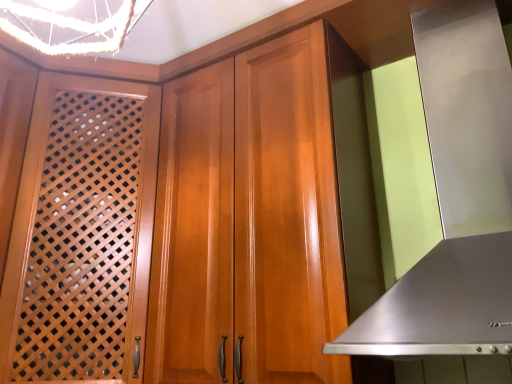
The width and height of the screenshot is (512, 384). Identify the location of stainless steel exhaust hood at right. (456, 198).

Measure the distance between point (436, 9) and camera.

3.82 feet.

What do you see at coordinates (456, 198) in the screenshot? I see `stainless steel exhaust hood at right` at bounding box center [456, 198].

I want to click on wooden lattice screen door at left, so click(x=81, y=234).

The image size is (512, 384). What do you see at coordinates (81, 234) in the screenshot? I see `wooden lattice screen door at left` at bounding box center [81, 234].

Measure the distance between point (57, 312) and camera.

Point (57, 312) and camera are 3.93 feet apart from each other.

At what (x,y) coordinates should I click in order to perform the action: click on stainless steel exhaust hood at right. Please return your answer as a coordinate pair (x, y). The width and height of the screenshot is (512, 384). Looking at the image, I should click on (456, 198).

Considering the relative positions of wooden lattice screen door at left and stainless steel exhaust hood at right in the image provided, is wooden lattice screen door at left to the left of stainless steel exhaust hood at right from the viewer's perspective?

Correct, you'll find wooden lattice screen door at left to the left of stainless steel exhaust hood at right.

Considering the positions of objects wooden lattice screen door at left and stainless steel exhaust hood at right in the image provided, who is behind, wooden lattice screen door at left or stainless steel exhaust hood at right?

wooden lattice screen door at left.

Is point (40, 354) positioned before point (442, 340)?

No, (40, 354) is behind (442, 340).

From the image's perspective, is wooden lattice screen door at left under stainless steel exhaust hood at right?

Indeed, from the image's perspective, wooden lattice screen door at left is shown beneath stainless steel exhaust hood at right.

From a real-world perspective, which is physically below, wooden lattice screen door at left or stainless steel exhaust hood at right?

In real-world perspective, wooden lattice screen door at left is lower.

Looking at their sizes, would you say wooden lattice screen door at left is wider or thinner than stainless steel exhaust hood at right?

wooden lattice screen door at left is wider than stainless steel exhaust hood at right.

Between wooden lattice screen door at left and stainless steel exhaust hood at right, which one has more height?

wooden lattice screen door at left.

In terms of size, does wooden lattice screen door at left appear bigger or smaller than stainless steel exhaust hood at right?

wooden lattice screen door at left is bigger than stainless steel exhaust hood at right.

Would you say stainless steel exhaust hood at right is part of wooden lattice screen door at left's contents?

No, stainless steel exhaust hood at right is not a part of wooden lattice screen door at left.

Are wooden lattice screen door at left and stainless steel exhaust hood at right making contact?

wooden lattice screen door at left and stainless steel exhaust hood at right are clearly separated.

Based on the photo, could you tell me if wooden lattice screen door at left is facing stainless steel exhaust hood at right?

No, wooden lattice screen door at left is not turned towards stainless steel exhaust hood at right.

Can you tell me how much wooden lattice screen door at left and stainless steel exhaust hood at right differ in facing direction?

The angle between the facing direction of wooden lattice screen door at left and the facing direction of stainless steel exhaust hood at right is 44.3 degrees.

How far apart are wooden lattice screen door at left and stainless steel exhaust hood at right?

34.21 inches.

At what (x,y) coordinates should I click in order to perform the action: click on screen door located underneath the stainless steel exhaust hood at right (from a real-world perspective). Please return your answer as a coordinate pair (x, y). The width and height of the screenshot is (512, 384). Looking at the image, I should click on (81, 234).

Considering the relative positions of stainless steel exhaust hood at right and wooden lattice screen door at left in the image provided, is stainless steel exhaust hood at right to the left or to the right of wooden lattice screen door at left?

stainless steel exhaust hood at right is positioned on wooden lattice screen door at left's right side.

Between stainless steel exhaust hood at right and wooden lattice screen door at left, which one is positioned behind?

wooden lattice screen door at left is behind.

Is point (496, 308) farther from camera compared to point (118, 380)?

That is False.

From the image's perspective, who appears lower, stainless steel exhaust hood at right or wooden lattice screen door at left?

From the image's view, wooden lattice screen door at left is below.

From a real-world perspective, which object stands above the other?

From a 3D spatial view, stainless steel exhaust hood at right is above.

Can you confirm if stainless steel exhaust hood at right is thinner than wooden lattice screen door at left?

Answer: Yes, stainless steel exhaust hood at right is thinner than wooden lattice screen door at left.

Between stainless steel exhaust hood at right and wooden lattice screen door at left, which one has less height?

With less height is stainless steel exhaust hood at right.

Considering the relative sizes of stainless steel exhaust hood at right and wooden lattice screen door at left in the image provided, is stainless steel exhaust hood at right smaller than wooden lattice screen door at left?

Yes.

Is stainless steel exhaust hood at right situated inside wooden lattice screen door at left or outside?

stainless steel exhaust hood at right is not enclosed by wooden lattice screen door at left.

Is stainless steel exhaust hood at right positioned far away from wooden lattice screen door at left?

No.

Is wooden lattice screen door at left at the back of stainless steel exhaust hood at right?

No, stainless steel exhaust hood at right is not facing away from wooden lattice screen door at left.

How far apart are stainless steel exhaust hood at right and wooden lattice screen door at left?

stainless steel exhaust hood at right and wooden lattice screen door at left are 34.21 inches apart.

Identify the location of screen door below the stainless steel exhaust hood at right (from the image's perspective). Image resolution: width=512 pixels, height=384 pixels. (81, 234).

The height and width of the screenshot is (384, 512). I want to click on screen door lying below the stainless steel exhaust hood at right (from the image's perspective), so click(x=81, y=234).

The image size is (512, 384). In order to click on screen door behind the stainless steel exhaust hood at right in this screenshot , I will do `click(81, 234)`.